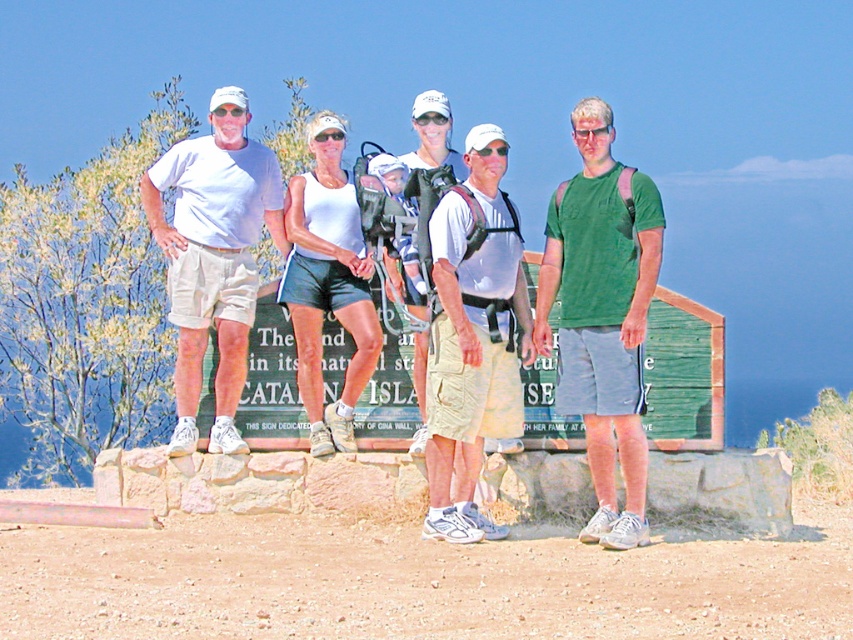
Is green cotton t-shirt at center further to the viewer compared to white cotton t-shirt at left?

No, it is not.

Does green cotton t-shirt at center appear over white cotton t-shirt at left?

No.

I want to click on green cotton t-shirt at center, so click(x=602, y=314).

Which is more to the left, green cotton t-shirt at center or light brown canvas shorts at center?

light brown canvas shorts at center is more to the left.

Between green cotton t-shirt at center and light brown canvas shorts at center, which one is positioned higher?

green cotton t-shirt at center

Is point (643, 248) closer to viewer compared to point (529, 340)?

Yes, point (643, 248) is closer to viewer.

Locate an element on the screen. The image size is (853, 640). green cotton t-shirt at center is located at coordinates (602, 314).

Between light brown canvas shorts at center and white cotton t-shirt at left, which one appears on the right side from the viewer's perspective?

Positioned to the right is light brown canvas shorts at center.

Can you confirm if light brown canvas shorts at center is positioned to the right of white cotton t-shirt at left?

Correct, you'll find light brown canvas shorts at center to the right of white cotton t-shirt at left.

Is point (454, 508) closer to viewer compared to point (213, 150)?

That is True.

Where is `light brown canvas shorts at center`? This screenshot has height=640, width=853. light brown canvas shorts at center is located at coordinates (473, 337).